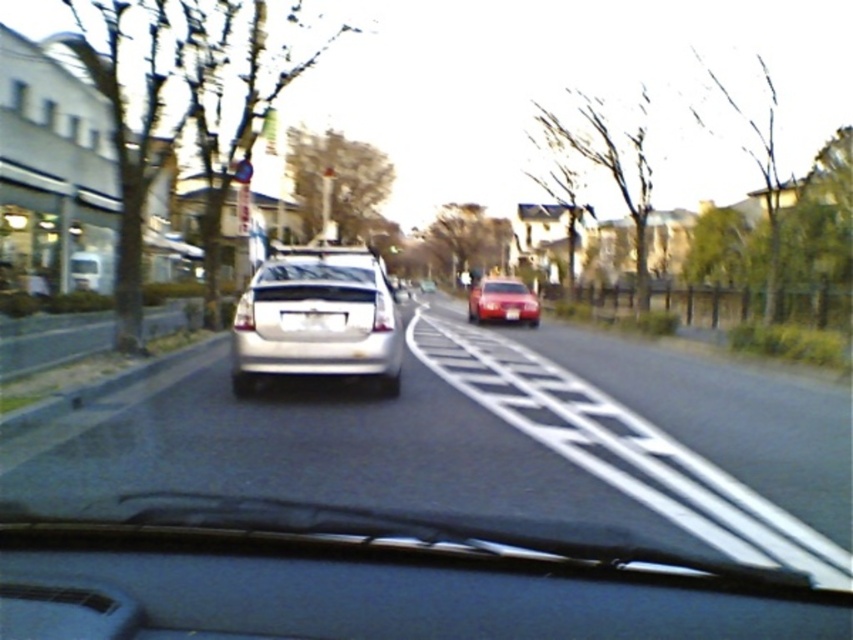
Question: Is white plastic license plate at center positioned at the back of white glossy license plate at center?

Choices:
 (A) yes
 (B) no

Answer: (B)

Question: Which is farther from the white glossy license plate at center?

Choices:
 (A) satin silver sedan at center
 (B) white plastic license plate at center

Answer: (B)

Question: Which object is farther from the camera taking this photo?

Choices:
 (A) satin silver sedan at center
 (B) white plastic license plate at center
 (C) white glossy license plate at center

Answer: (C)

Question: Which object is the closest to the satin silver sedan at center?

Choices:
 (A) shiny red car at center
 (B) white glossy license plate at center

Answer: (B)

Question: Does satin silver sedan at center have a larger size compared to shiny red car at center?

Choices:
 (A) yes
 (B) no

Answer: (B)

Question: Is satin silver sedan at center wider than white plastic license plate at center?

Choices:
 (A) yes
 (B) no

Answer: (A)